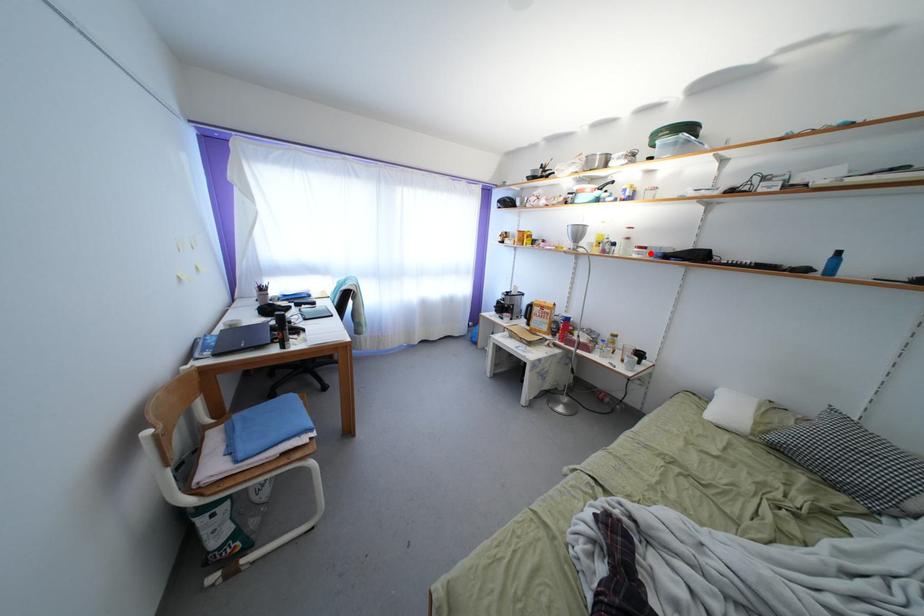
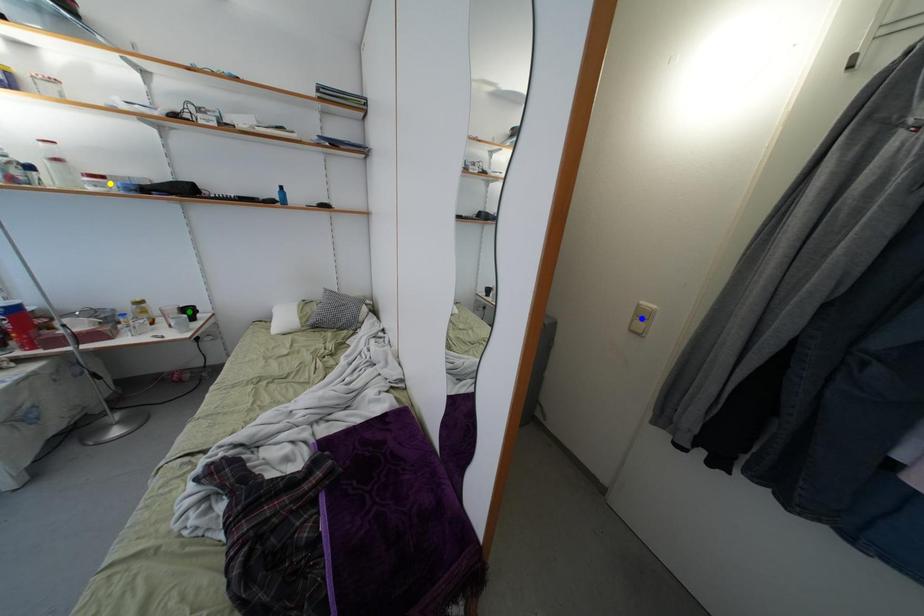
Question: I am providing you with two images of the same scene from different viewpoints. A red point is marked on the first image. You are given multiple points on the second image. In image 2, which mark is for the same physical point as the one in image 1?

Choices:
 (A) yellow point
 (B) blue point
 (C) green point

Answer: (A)